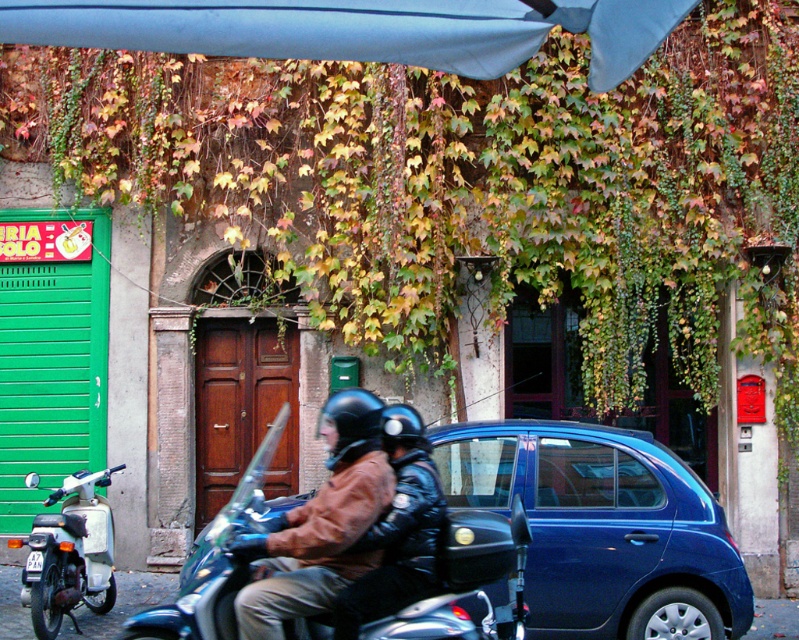
You are a delivery person who needs to attach a GPS tracker to either the brown leather jacket at center or the white plastic license plate at center. Which item would allow the GPS tracker to be more visible to passing vehicles?

The brown leather jacket at center has a greater height compared to the white plastic license plate at center, so attaching the GPS tracker to the brown leather jacket at center would make it more visible to passing vehicles.

You are a delivery person who needs to place a package under the blue fabric umbrella at upper center. Your scooter is parked at the shiny chrome scooter at center. Can you reach the umbrella without moving the scooter?

The distance between the shiny chrome scooter at center and the blue fabric umbrella at upper center is 6.58 feet. Since the umbrella is 6.58 feet away from the scooter, you can reach it without moving the scooter if your arm or package can extend that far, but typically, this distance might require moving closer.